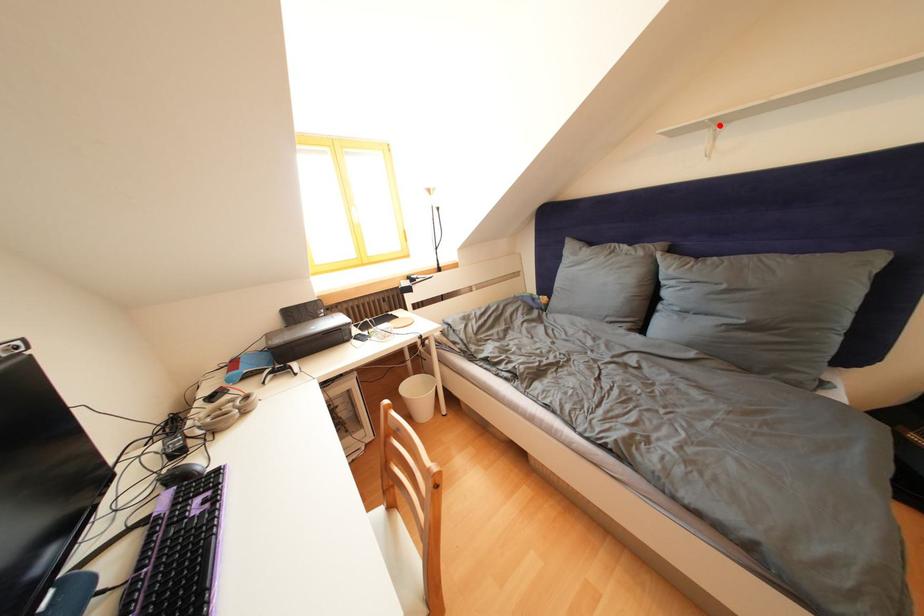
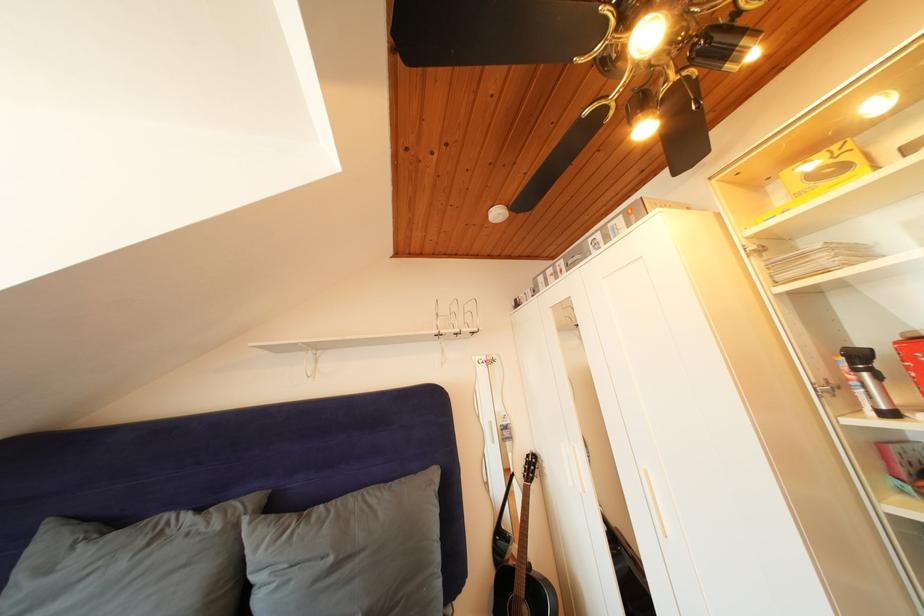
The point at the highlighted location is marked in the first image. Where is the corresponding point in the second image?

(315, 350)